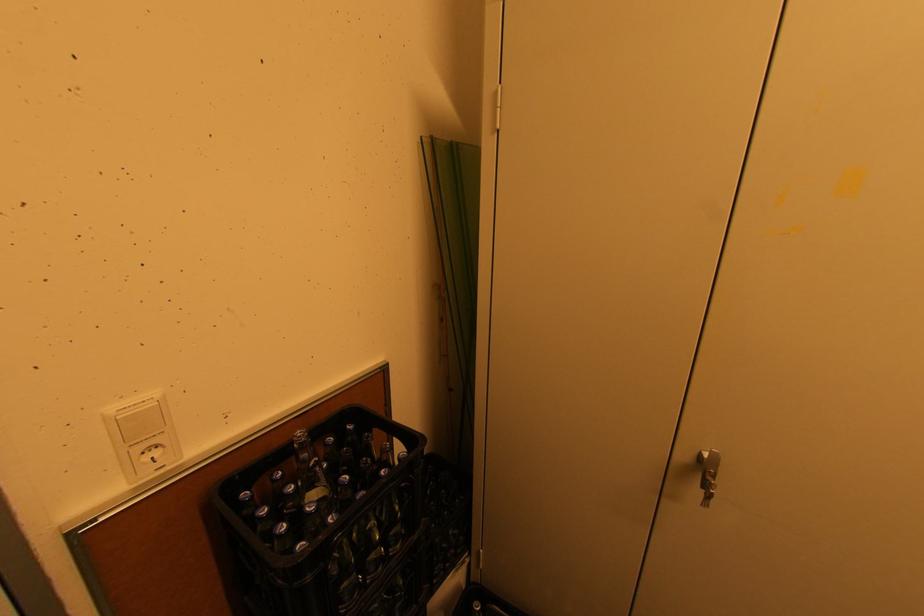
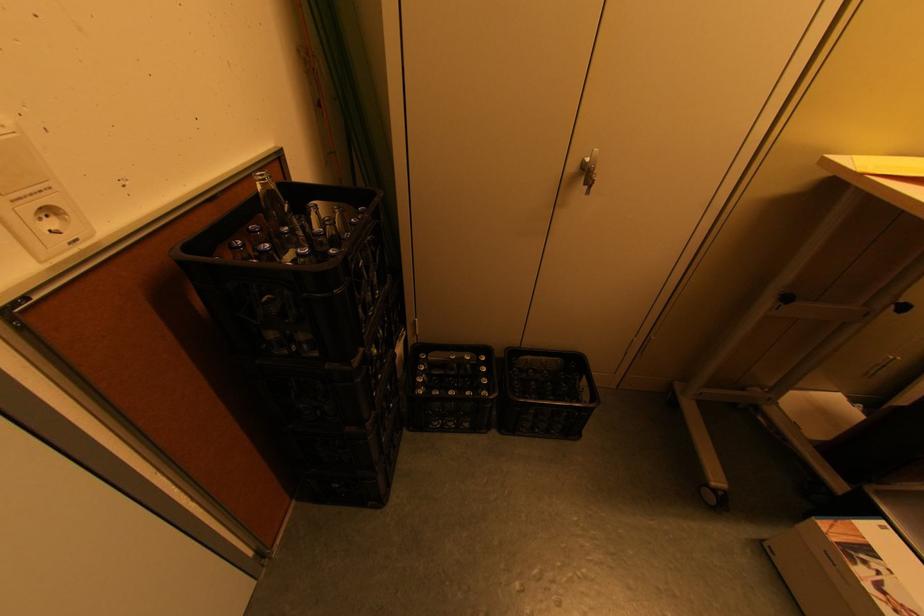
Locate, in the second image, the point that corresponds to point (275, 476) in the first image.

(234, 244)